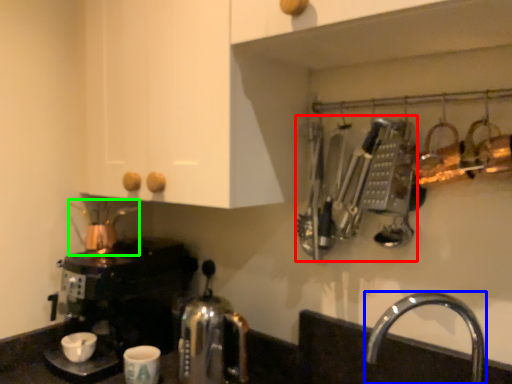
Question: Which object is the closest to the cutlery (highlighted by a red box)? Choose among these: tap (highlighted by a blue box) or tea pot (highlighted by a green box).

Choices:
 (A) tap
 (B) tea pot

Answer: (A)